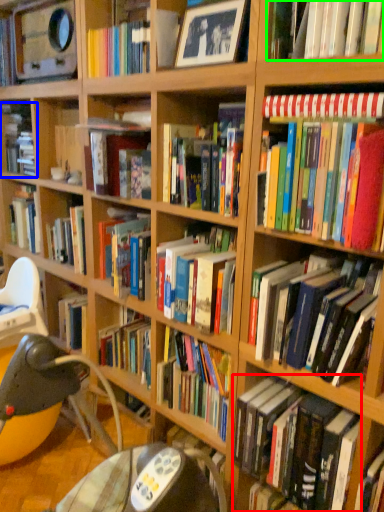
Question: Considering the real-world distances, which object is farthest from book (highlighted by a red box)? book (highlighted by a blue box) or book (highlighted by a green box)?

Choices:
 (A) book
 (B) book

Answer: (A)